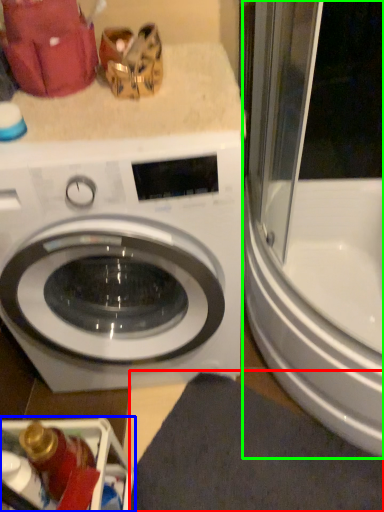
Question: Estimate the real-world distances between objects in this image. Which object is farther from bath mat (highlighted by a red box), dish washer (highlighted by a blue box) or screen door (highlighted by a green box)?

Choices:
 (A) dish washer
 (B) screen door

Answer: (B)